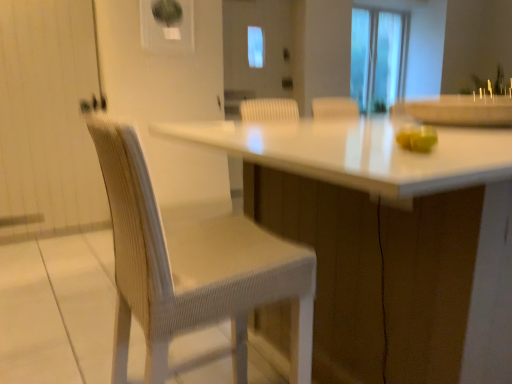
You are a GUI agent. You are given a task and a screenshot of the screen. Output one action in this format:
    pyautogui.click(x=<x>, y=<y>)
    Task: Click on the vacant position to the left of green matte apple at right
    
    Given the screenshot: What is the action you would take?
    pyautogui.click(x=351, y=154)